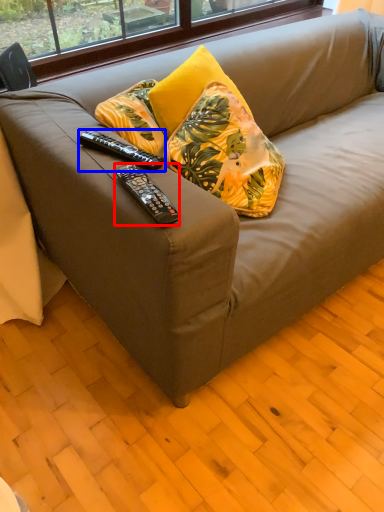
Question: Which object is further to the camera taking this photo, remote control (highlighted by a red box) or remote control (highlighted by a blue box)?

Choices:
 (A) remote control
 (B) remote control

Answer: (B)